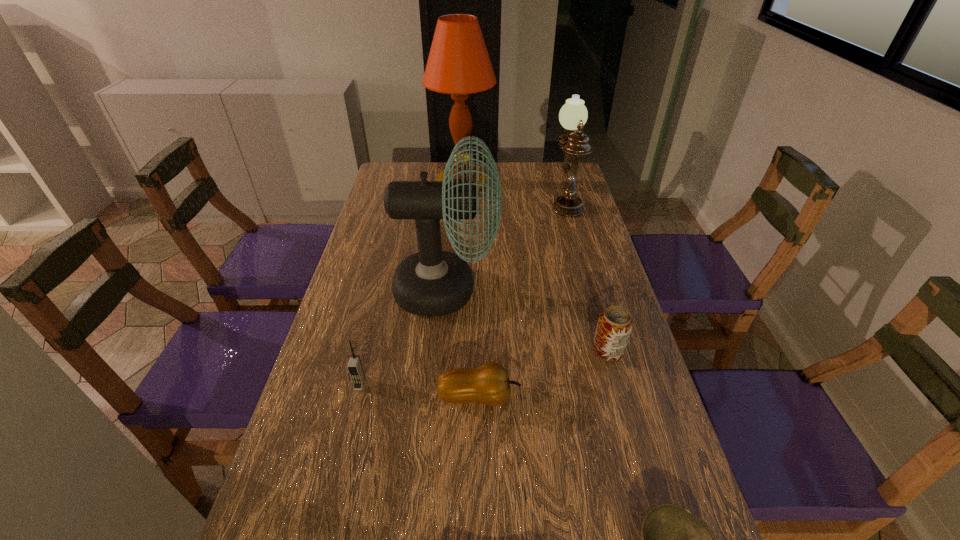
Where is `object that is at the far left corner`? The width and height of the screenshot is (960, 540). object that is at the far left corner is located at coordinates (458, 64).

This screenshot has width=960, height=540. I want to click on object at the far right corner, so click(573, 115).

Locate an element on the screen. vacant space at the far edge is located at coordinates (540, 188).

This screenshot has width=960, height=540. I want to click on free space at the left edge, so click(x=393, y=266).

The image size is (960, 540). In the image, there is a desktop. In order to click on vacant area at the right edge in this screenshot , I will do `click(594, 390)`.

In order to click on free location at the far left corner in this screenshot , I will do `click(384, 168)`.

In order to click on vacant point located between the oil lamp and the beer can in this screenshot , I will do `click(587, 275)`.

The height and width of the screenshot is (540, 960). What are the coordinates of `unoccupied position between the third farthest object and the fourth farthest object` in the screenshot? It's located at (527, 320).

Where is `vacant area that lies between the second shortest object and the fourth nearest object`? Image resolution: width=960 pixels, height=540 pixels. vacant area that lies between the second shortest object and the fourth nearest object is located at coordinates (543, 374).

In order to click on vacant area that lies between the third tallest object and the beer can in this screenshot , I will do `click(587, 275)`.